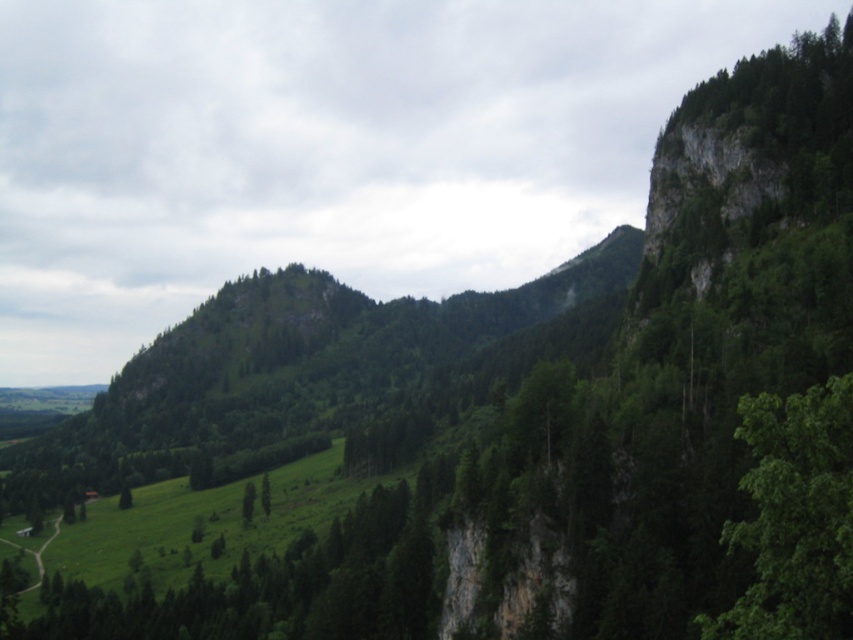
Consider the image. You are standing in the mountain landscape and want to know which of the two points, point (798, 531) or point (252, 506), is nearer to you. Based on the scene description, can you determine which point is closer?

Point (798, 531) is closer to the viewer than point (252, 506).

You are a hiker planning to set up a tent between the green leafy tree at lower center and the green matte tree at center. Given that your tent requires a 3 meter space, will there be enough room between them?

The green leafy tree at lower center and green matte tree at center are 2.76 meters apart from each other, so the distance is insufficient for the tent requiring 3 meters.

You are planning to plant a new tree in this mountainous area. The green leafy tree at lower center and the green matte tree at center are already present. Which existing tree should you consider for spacing requirements due to its size?

The green leafy tree at lower center is larger in size compared to the green matte tree at center, so you should consider its spacing requirements first.